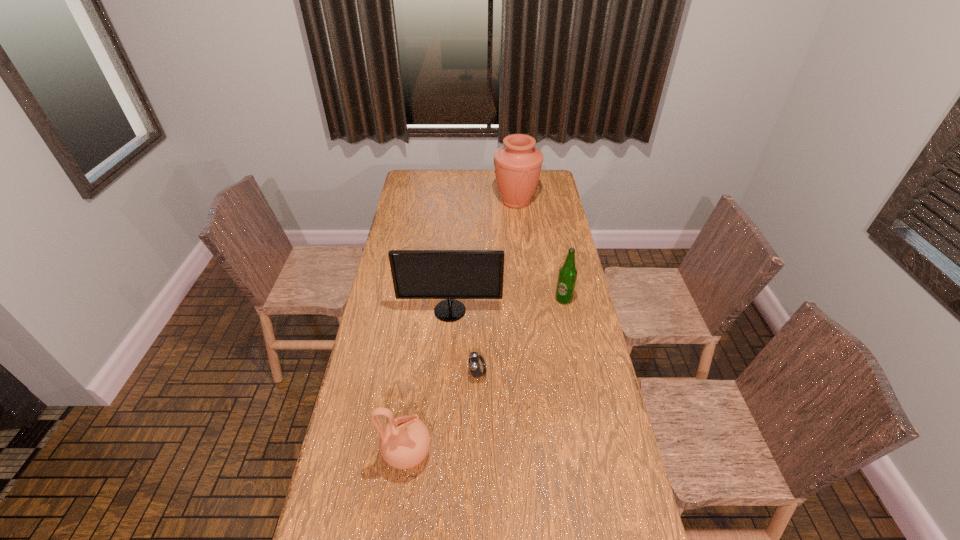
Where is `free spot located on the face of the shortest object`? This screenshot has width=960, height=540. free spot located on the face of the shortest object is located at coordinates (516, 373).

The height and width of the screenshot is (540, 960). I want to click on object present at the far edge, so click(518, 163).

Image resolution: width=960 pixels, height=540 pixels. What are the coordinates of `computer monitor at the left edge` in the screenshot? It's located at (417, 274).

What are the coordinates of `pottery positioned at the left edge` in the screenshot? It's located at click(404, 442).

At what (x,y) coordinates should I click in order to perform the action: click on vase located in the right edge section of the desktop. Please return your answer as a coordinate pair (x, y). Image resolution: width=960 pixels, height=540 pixels. Looking at the image, I should click on (518, 163).

Find the location of `beer bottle that is at the right edge`. beer bottle that is at the right edge is located at coordinates (567, 276).

Where is `object located at the far right corner`? object located at the far right corner is located at coordinates (518, 163).

Image resolution: width=960 pixels, height=540 pixels. I want to click on vacant space at the far edge of the desktop, so click(469, 179).

Find the location of a particular element. The height and width of the screenshot is (540, 960). free space at the left edge is located at coordinates (420, 205).

In the image, there is a desktop. What are the coordinates of `vacant area at the right edge` in the screenshot? It's located at (611, 465).